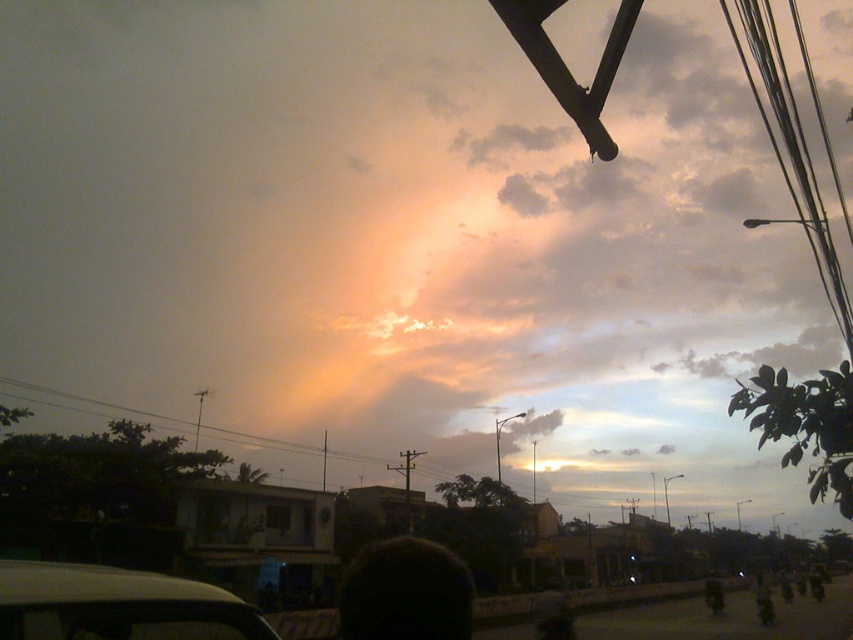
Consider the image. Can you confirm if white matte car at lower left is shorter than metallic wires at upper right?

Yes.

Who is shorter, white matte car at lower left or metallic wires at upper right?

white matte car at lower left

Is point (97, 579) positioned in front of point (779, 51)?

Yes, it is.

This screenshot has width=853, height=640. Identify the location of white matte car at lower left. (117, 605).